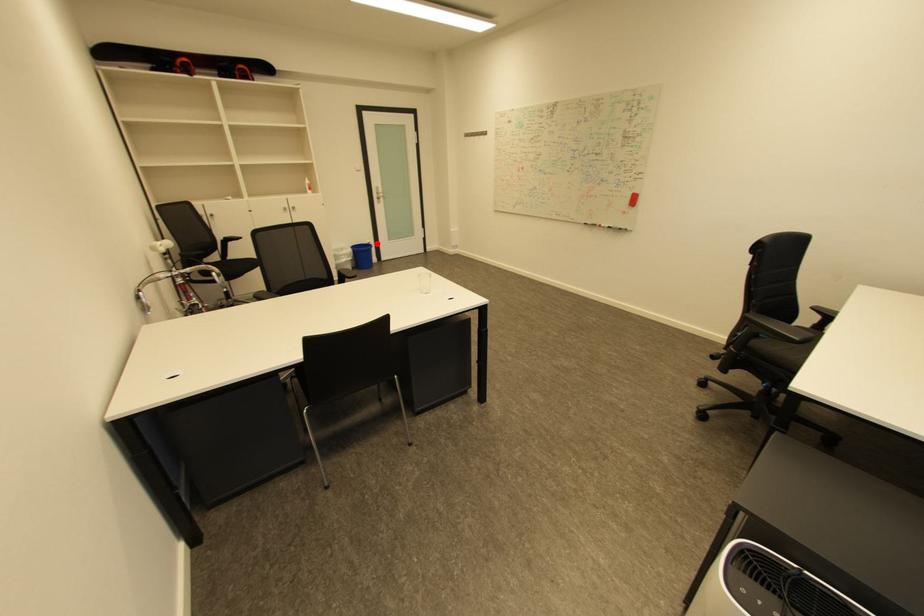
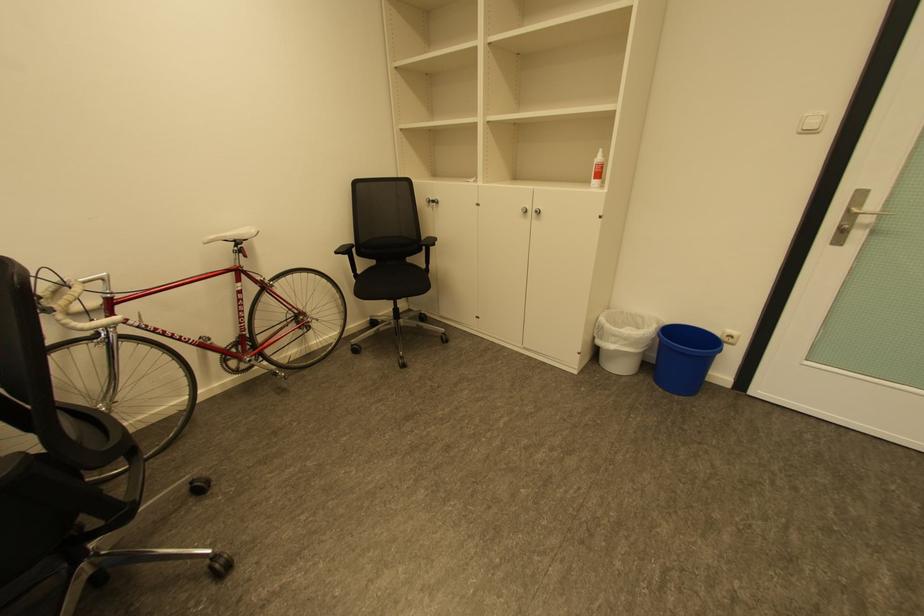
Question: I am providing you with two images of the same scene from different viewpoints. Given a red point in image1, look at the same physical point in image2. Is it:

Choices:
 (A) Closer to the viewpoint
 (B) Farther from the viewpoint

Answer: (B)